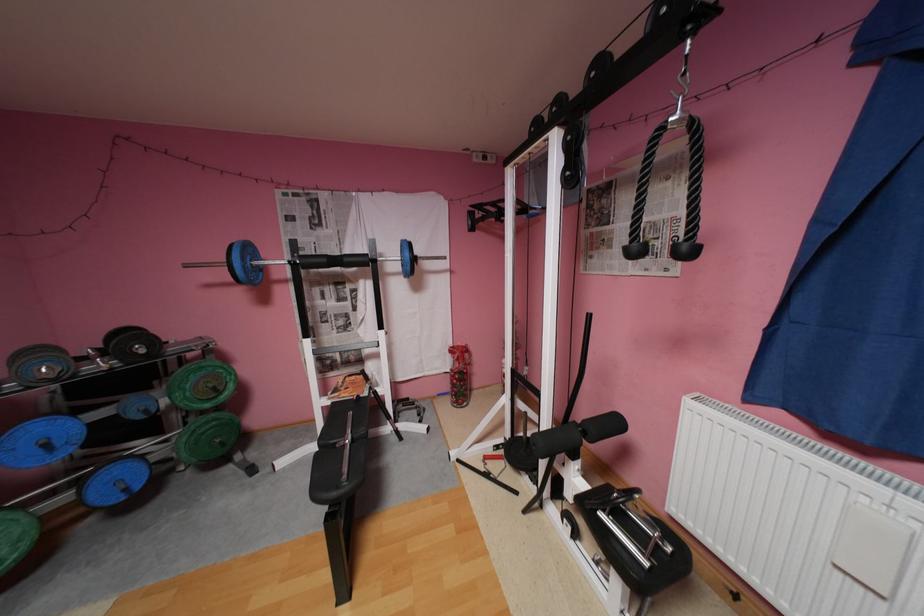
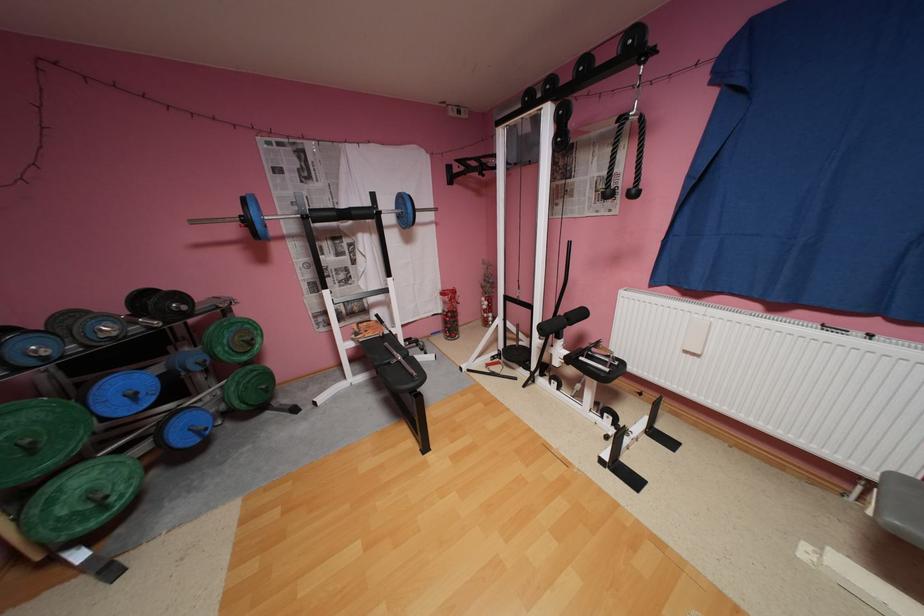
Question: Based on the continuous images, in which direction is the camera rotating? Reply with the corresponding letter.

Choices:
 (A) Left
 (B) Right
 (C) Up
 (D) Down

Answer: (B)